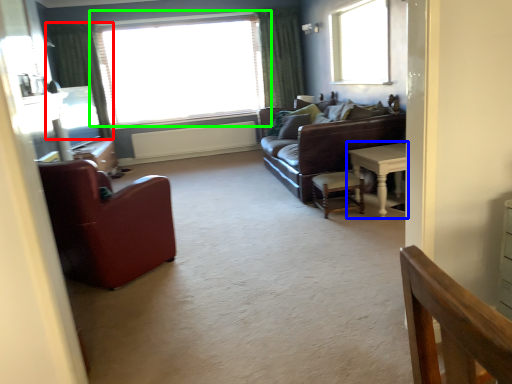
Question: Which object is the closest to the curtain (highlighted by a red box)? Choose among these: table (highlighted by a blue box) or window (highlighted by a green box).

Choices:
 (A) table
 (B) window

Answer: (B)